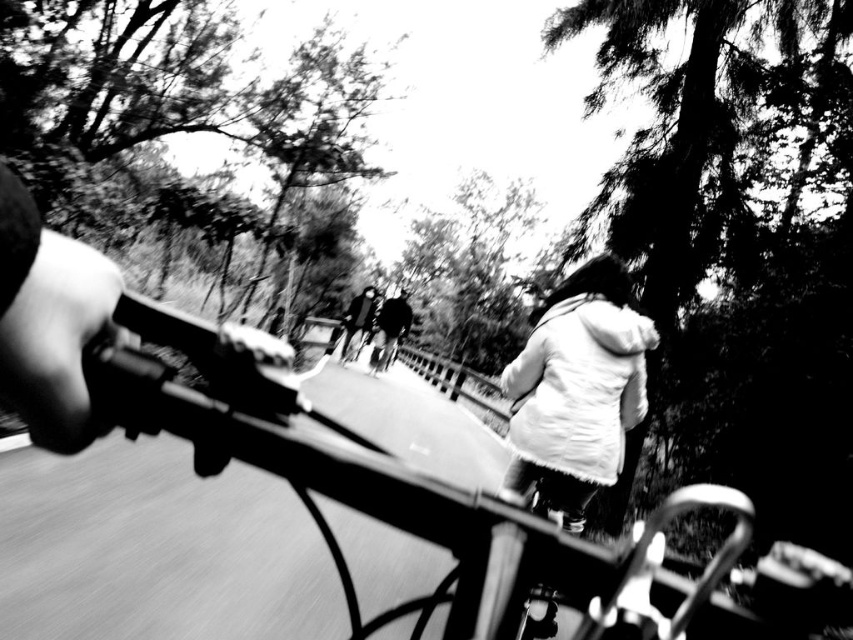
Does dark fabric jacket at center have a lesser width compared to dark gray fabric jacket at center?

No.

Between dark fabric jacket at center and dark gray fabric jacket at center, which one appears on the left side from the viewer's perspective?

From the viewer's perspective, dark fabric jacket at center appears more on the left side.

Who is more forward, (392, 310) or (366, 294)?

Positioned in front is point (392, 310).

This screenshot has width=853, height=640. In order to click on dark fabric jacket at center in this screenshot , I will do `click(390, 330)`.

Who is taller, white fluffy coat at center or dark gray fabric jacket at center?

dark gray fabric jacket at center

Does white fluffy coat at center have a lesser width compared to dark gray fabric jacket at center?

Indeed, white fluffy coat at center has a lesser width compared to dark gray fabric jacket at center.

Who is more forward, (595, 273) or (350, 337)?

Positioned in front is point (595, 273).

Locate an element on the screen. white fluffy coat at center is located at coordinates pos(577,388).

Does white fluffy coat at center appear on the right side of dark fabric jacket at center?

Correct, you'll find white fluffy coat at center to the right of dark fabric jacket at center.

Between white fluffy coat at center and dark fabric jacket at center, which one appears on the right side from the viewer's perspective?

white fluffy coat at center

Between point (567, 509) and point (396, 314), which one is positioned in front?

Point (567, 509)

Identify the location of white fluffy coat at center. (577, 388).